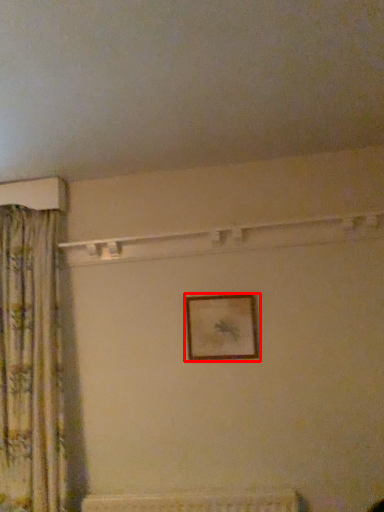
Question: Where is picture frame (annotated by the red box) located in relation to curtain in the image?

Choices:
 (A) left
 (B) right

Answer: (B)